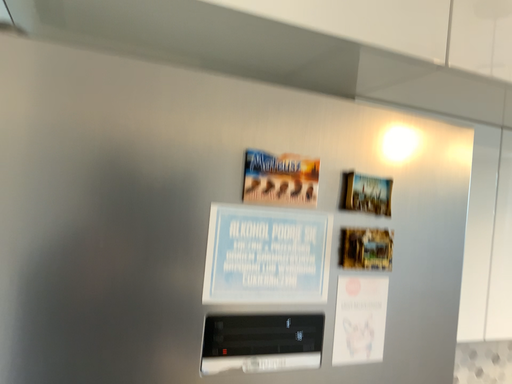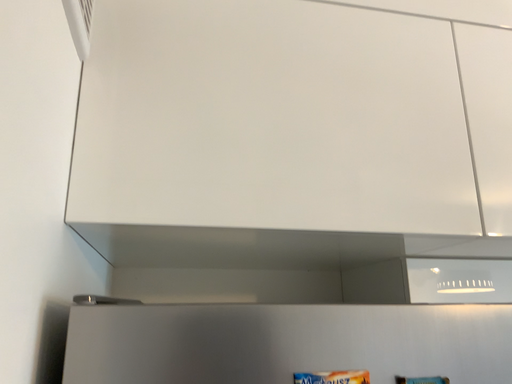
Question: How did the camera likely rotate when shooting the video?

Choices:
 (A) rotated right
 (B) rotated left

Answer: (B)